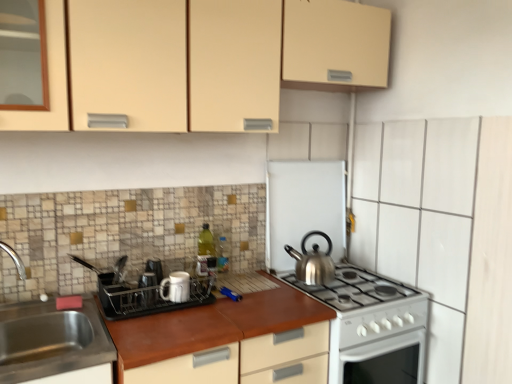
Question: Is white matte dish rack at center, which appears as the first appliance when viewed from the front, not near white ceramic mug at center, arranged as the 2th appliance when viewed from the back?

Choices:
 (A) yes
 (B) no

Answer: (B)

Question: From a real-world perspective, is white matte dish rack at center, the 1th appliance from the left, positioned under white ceramic mug at center, acting as the 2th appliance starting from the front, based on gravity?

Choices:
 (A) yes
 (B) no

Answer: (A)

Question: Is white matte dish rack at center, the 1th appliance from the left, at the right side of white ceramic mug at center, the 2th appliance positioned from the right?

Choices:
 (A) no
 (B) yes

Answer: (A)

Question: Is white matte dish rack at center, the third appliance in the right-to-left sequence, turned away from white ceramic mug at center, arranged as the 2th appliance when viewed from the back?

Choices:
 (A) yes
 (B) no

Answer: (A)

Question: Is white ceramic mug at center, arranged as the second appliance when viewed from the left, a part of white matte dish rack at center, which appears as the first appliance when viewed from the front?

Choices:
 (A) no
 (B) yes

Answer: (B)

Question: Is white matte dish rack at center, the 1th appliance from the left, smaller than white ceramic mug at center, arranged as the 2th appliance when viewed from the back?

Choices:
 (A) yes
 (B) no

Answer: (B)

Question: Does silver metallic kettle at center-right have a lesser height compared to white matte dish rack at center, the third appliance in the right-to-left sequence?

Choices:
 (A) no
 (B) yes

Answer: (A)

Question: From the image's perspective, would you say silver metallic kettle at center-right is positioned over white matte dish rack at center, which appears as the first appliance when viewed from the front?

Choices:
 (A) yes
 (B) no

Answer: (A)

Question: Does silver metallic kettle at center-right turn towards white matte dish rack at center, which appears as the first appliance when viewed from the front?

Choices:
 (A) no
 (B) yes

Answer: (A)

Question: Is silver metallic kettle at center-right to the right of white matte dish rack at center, the third appliance in the right-to-left sequence, from the viewer's perspective?

Choices:
 (A) no
 (B) yes

Answer: (B)

Question: From the image's perspective, does silver metallic kettle at center-right appear lower than white matte dish rack at center, the 1th appliance from the left?

Choices:
 (A) yes
 (B) no

Answer: (B)

Question: Are silver metallic kettle at center-right and white matte dish rack at center, the 1th appliance from the left, making contact?

Choices:
 (A) no
 (B) yes

Answer: (A)

Question: Would you consider white matte dish rack at center, the 1th appliance from the left, to be distant from silver metallic kettle at center-right?

Choices:
 (A) yes
 (B) no

Answer: (B)